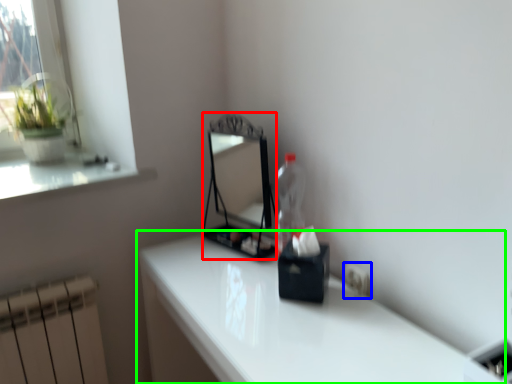
Question: Which object is positioned farthest from mirror (highlighted by a red box)? Select from electric outlet (highlighted by a blue box) and table (highlighted by a green box).

Choices:
 (A) electric outlet
 (B) table

Answer: (A)